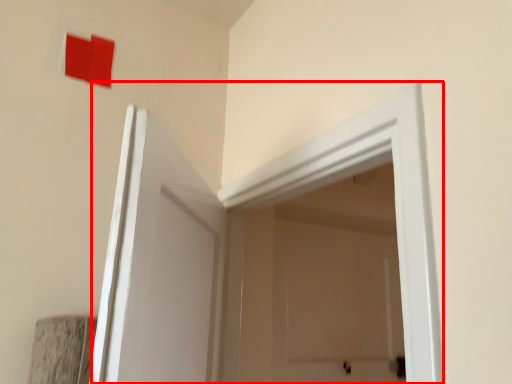
Question: From the image's perspective, where is door (annotated by the red box) located relative to square?

Choices:
 (A) below
 (B) above

Answer: (A)